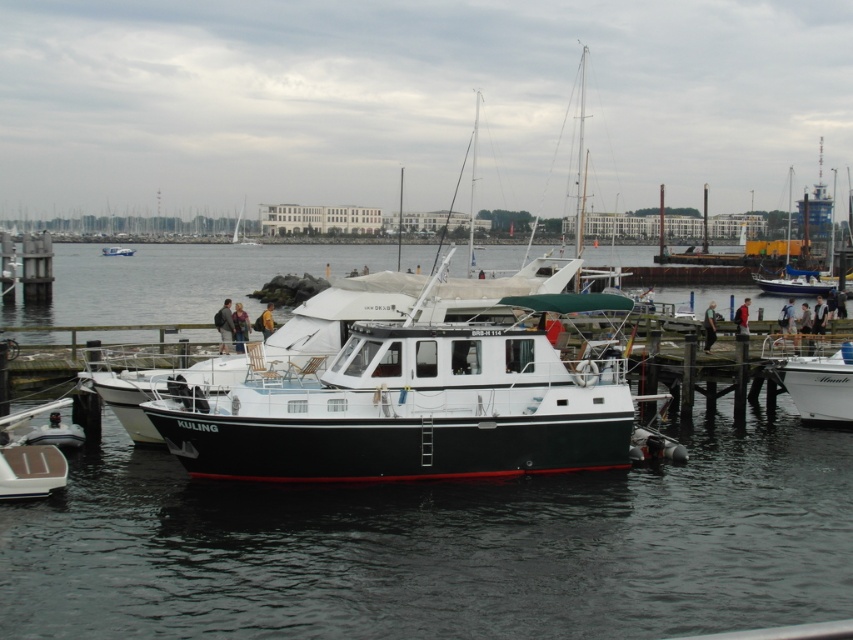
Which is above, white glossy boat at right or white glossy boat at center?

white glossy boat at center is above.

Does white glossy boat at right have a lesser width compared to white glossy boat at center?

Correct, white glossy boat at right's width is less than white glossy boat at center's.

Find the location of a particular element. The image size is (853, 640). white glossy boat at right is located at coordinates [814, 378].

Between black glossy water at center and white glossy boat at right, which one is positioned higher?

black glossy water at center

Can you confirm if black glossy water at center is positioned below white glossy boat at right?

No, black glossy water at center is not below white glossy boat at right.

Does point (585, 515) come behind point (840, 388)?

No, (585, 515) is in front of (840, 388).

Locate an element on the screen. black glossy water at center is located at coordinates (442, 547).

Does black glossy water at center have a greater height compared to white glossy boat at center?

Yes, black glossy water at center is taller than white glossy boat at center.

Can you confirm if black glossy water at center is bigger than white glossy boat at center?

Indeed, black glossy water at center has a larger size compared to white glossy boat at center.

At what (x,y) coordinates should I click in order to perform the action: click on black glossy water at center. Please return your answer as a coordinate pair (x, y). Looking at the image, I should click on (442, 547).

The width and height of the screenshot is (853, 640). Identify the location of black glossy water at center. (442, 547).